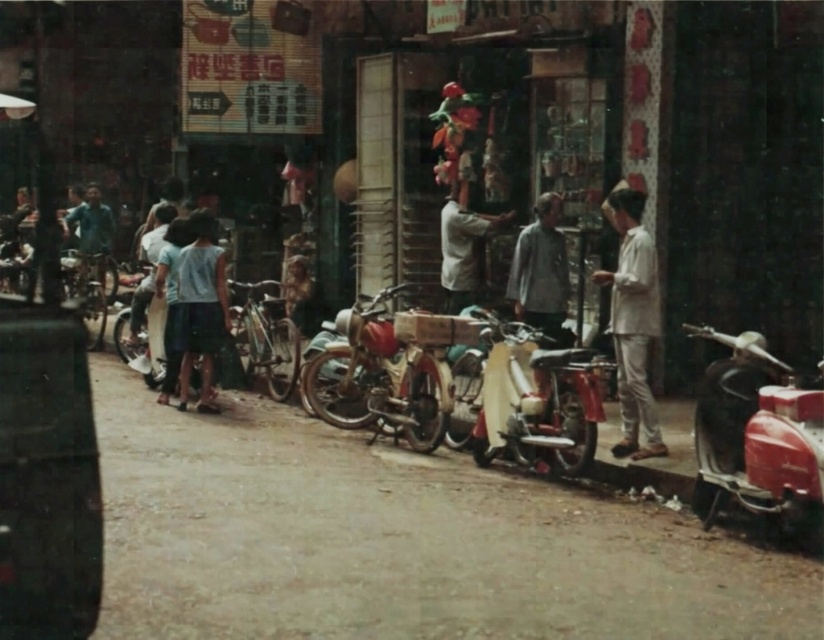
You are a fashion designer observing the clothing items in the scene. Which clothing item is closer to the ground, the light blue fabric skirt at center or the light brown fabric shirt at center?

The light blue fabric skirt at center is positioned under the light brown fabric shirt at center, so it is closer to the ground.

You are standing on the street and want to greet the person wearing the white cotton shirt at right and the light blue fabric skirt at center. Which person should you approach first if you want to greet the closer one first?

You should greet the white cotton shirt at right first because it is closer to you than the light blue fabric skirt at center.

You are standing on the street and see both the shiny red motorcycle at center and the shiny chrome motorcycle at center. Which motorcycle is nearer to you?

The shiny red motorcycle at center is closer to the viewer than the shiny chrome motorcycle at center.